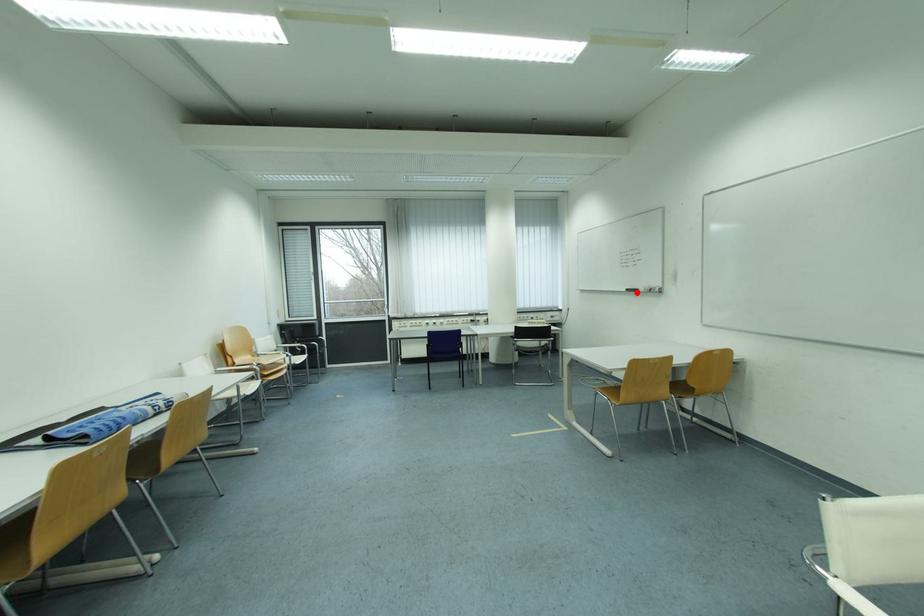
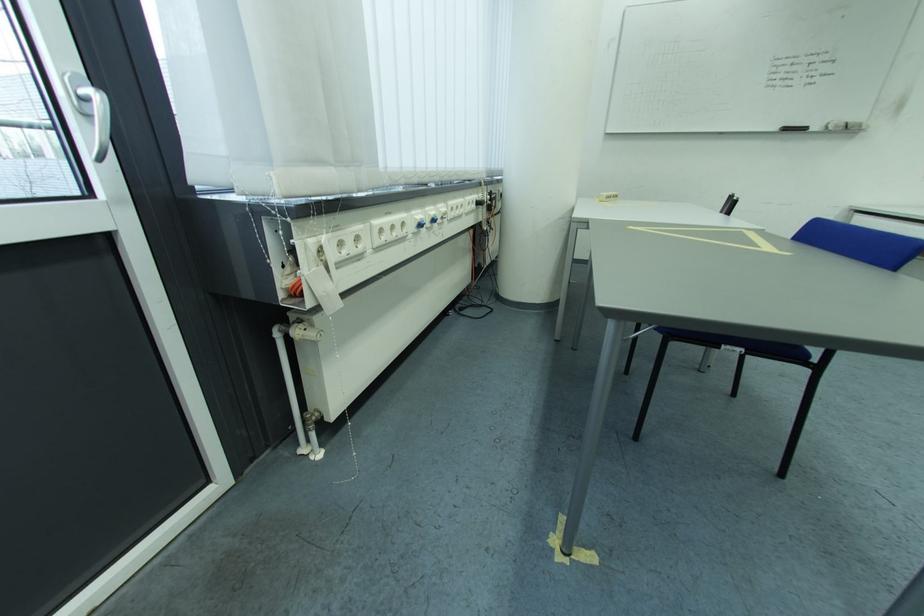
The point at the highlighted location is marked in the first image. Where is the corresponding point in the second image?

(796, 131)